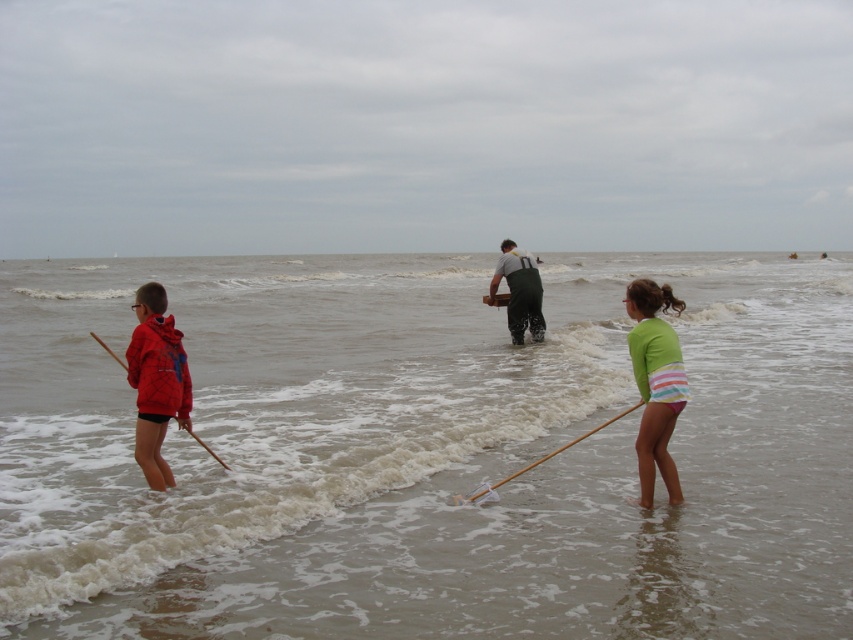
Who is shorter, brown sandy water at center or green striped swimsuit at lower right?

green striped swimsuit at lower right

Which of these two, brown sandy water at center or green striped swimsuit at lower right, stands taller?

brown sandy water at center is taller.

At what (x,y) coordinates should I click in order to perform the action: click on brown sandy water at center. Please return your answer as a coordinate pair (x, y). Looking at the image, I should click on (425, 452).

Does green striped swimsuit at lower right have a smaller size compared to green rubber boots at center?

Indeed, green striped swimsuit at lower right has a smaller size compared to green rubber boots at center.

Which is above, green striped swimsuit at lower right or green rubber boots at center?

green rubber boots at center

Is point (675, 378) more distant than point (521, 252)?

No, (675, 378) is in front of (521, 252).

Where is `green striped swimsuit at lower right`? The width and height of the screenshot is (853, 640). green striped swimsuit at lower right is located at coordinates (654, 384).

Which of these two, matte red hoodie at left or wooden stick at left, stands shorter?

matte red hoodie at left

Is point (154, 296) closer to camera compared to point (115, 358)?

That is False.

Does point (148, 301) lie behind point (96, 339)?

No, it is not.

Where is `matte red hoodie at left`? The height and width of the screenshot is (640, 853). matte red hoodie at left is located at coordinates (155, 381).